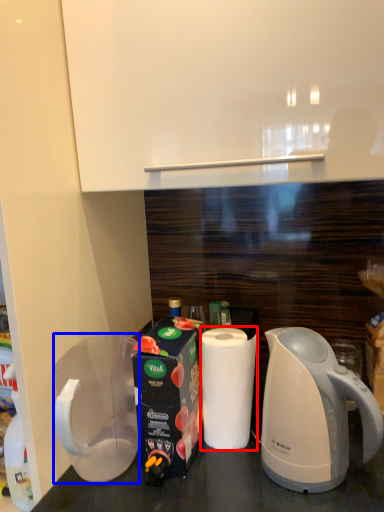
Question: Which of the following is the closest to the observer, paper towel (highlighted by a red box) or pitcher (highlighted by a blue box)?

Choices:
 (A) paper towel
 (B) pitcher

Answer: (B)